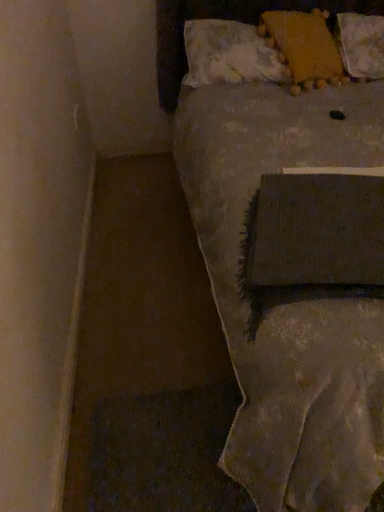
Question: Is textured gray blanket at center to the left or to the right of yellow fabric pillow at upper right, positioned as the 3th pillow in right-to-left order, in the image?

Choices:
 (A) right
 (B) left

Answer: (A)

Question: Is textured gray blanket at center spatially inside yellow fabric pillow at upper right, positioned as the 3th pillow in right-to-left order, or outside of it?

Choices:
 (A) inside
 (B) outside

Answer: (B)

Question: Estimate the real-world distances between objects in this image. Which object is farther from the fluffy yellow pillow at upper right, acting as the first pillow starting from the right?

Choices:
 (A) yellow fabric pillow at upper right, the first pillow from the left
 (B) yellow fabric pillow at upper right, which appears as the 2th pillow when viewed from the right
 (C) textured gray blanket at center

Answer: (C)

Question: Which object is the farthest from the yellow fabric pillow at upper right, which appears as the 2th pillow when viewed from the right?

Choices:
 (A) fluffy yellow pillow at upper right, the 3th pillow when ordered from left to right
 (B) textured gray blanket at center
 (C) yellow fabric pillow at upper right, the first pillow from the left

Answer: (B)